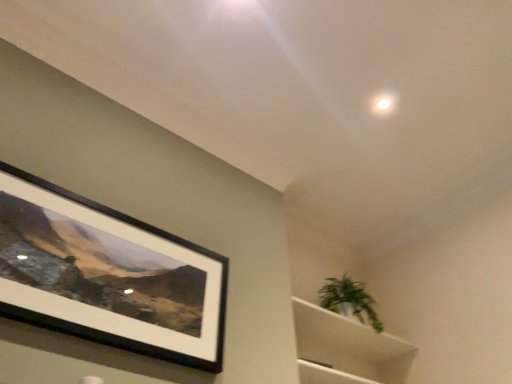
Question: Is green leafy plant at upper right inside the boundaries of black matte picture frame at upper left, or outside?

Choices:
 (A) outside
 (B) inside

Answer: (A)

Question: From a real-world perspective, relative to black matte picture frame at upper left, is green leafy plant at upper right vertically above or below?

Choices:
 (A) above
 (B) below

Answer: (A)

Question: Which object is the closest to the green leafy plant at upper right?

Choices:
 (A) black matte picture frame at upper left
 (B) white matte cabinet at lower right

Answer: (B)

Question: Estimate the real-world distances between objects in this image. Which object is farther from the white matte cabinet at lower right?

Choices:
 (A) black matte picture frame at upper left
 (B) green leafy plant at upper right

Answer: (A)